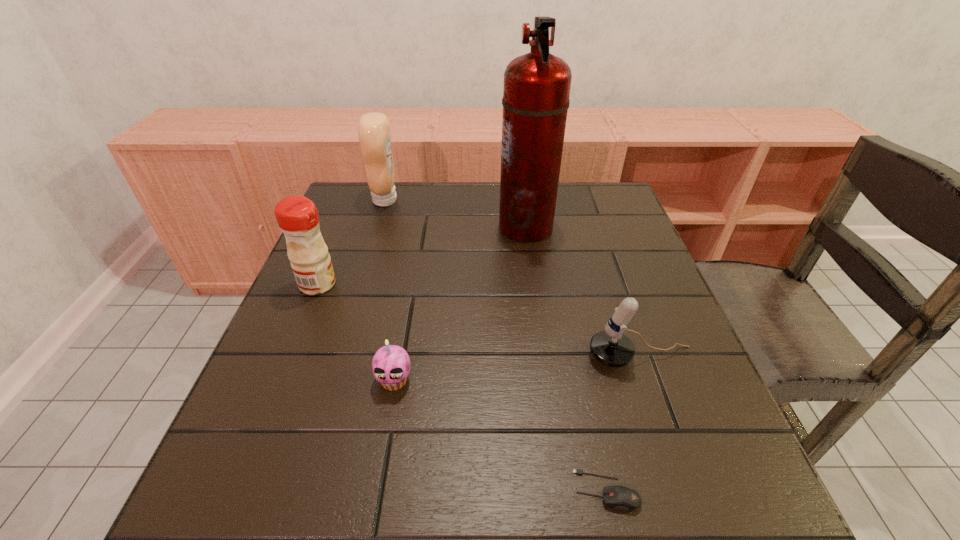
The image size is (960, 540). Identify the location of fire extinguisher. (536, 91).

Find the location of a particular element. This screenshot has height=540, width=960. the second object from left to right is located at coordinates (374, 131).

This screenshot has height=540, width=960. I want to click on the farther condiment, so click(x=374, y=131).

The width and height of the screenshot is (960, 540). In order to click on the leftmost object in this screenshot , I will do `click(297, 216)`.

Locate an element on the screen. This screenshot has height=540, width=960. the left condiment is located at coordinates (297, 216).

You are a GUI agent. You are given a task and a screenshot of the screen. Output one action in this format:
    pyautogui.click(x=<x>, y=<y>)
    Task: Click on the microphone
    This screenshot has height=540, width=960.
    Given the screenshot: What is the action you would take?
    pyautogui.click(x=611, y=347)

In order to click on cupcake in this screenshot , I will do `click(391, 364)`.

Image resolution: width=960 pixels, height=540 pixels. I want to click on the fourth object from right to left, so click(x=391, y=364).

Find the location of a particular element. the nearest object is located at coordinates (622, 498).

In order to click on mouse in this screenshot , I will do `click(622, 498)`.